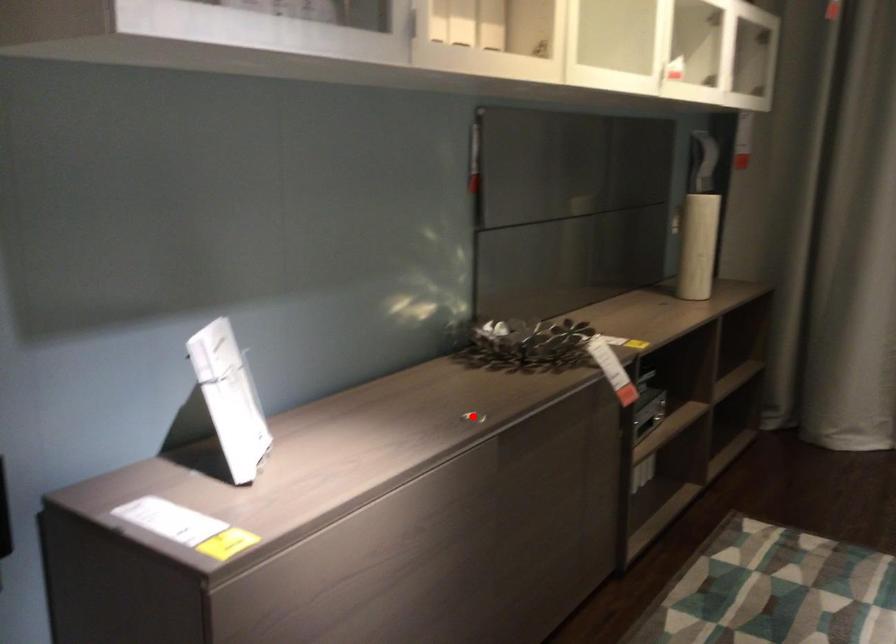
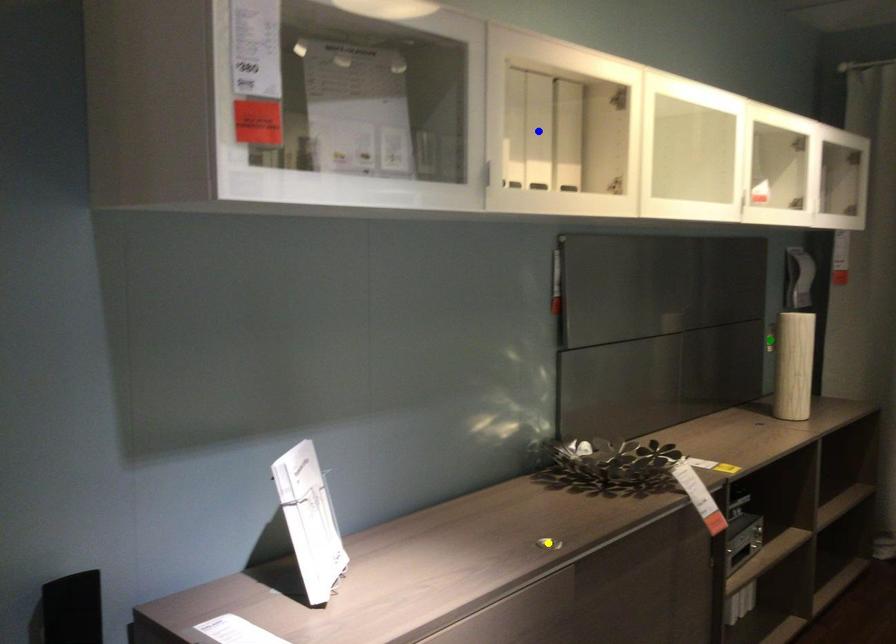
Question: I am providing you with two images of the same scene from different viewpoints. A red point is marked on the first image. You are given multiple points on the second image. In image 2, which mark is for the same physical point as the one in image 1?

Choices:
 (A) yellow point
 (B) blue point
 (C) green point

Answer: (A)